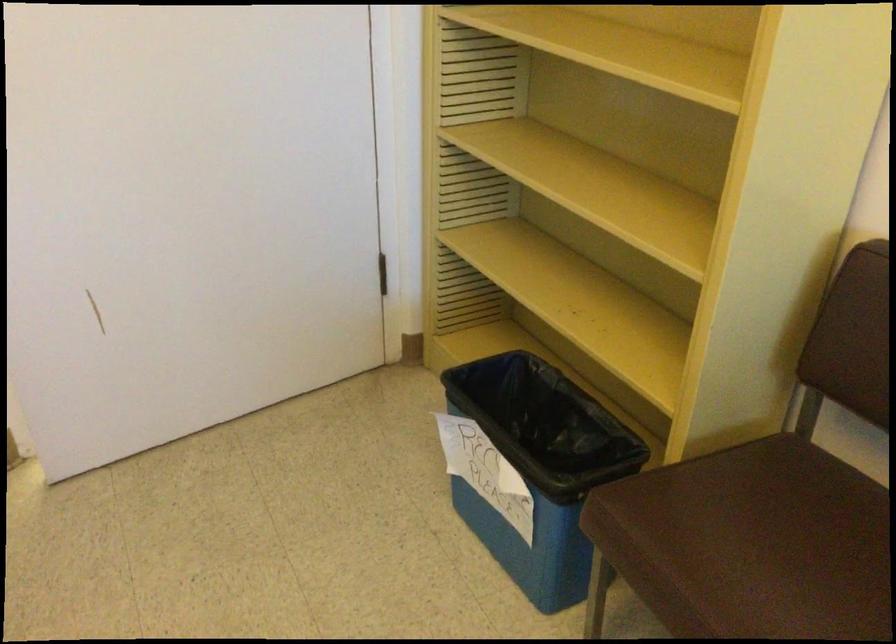
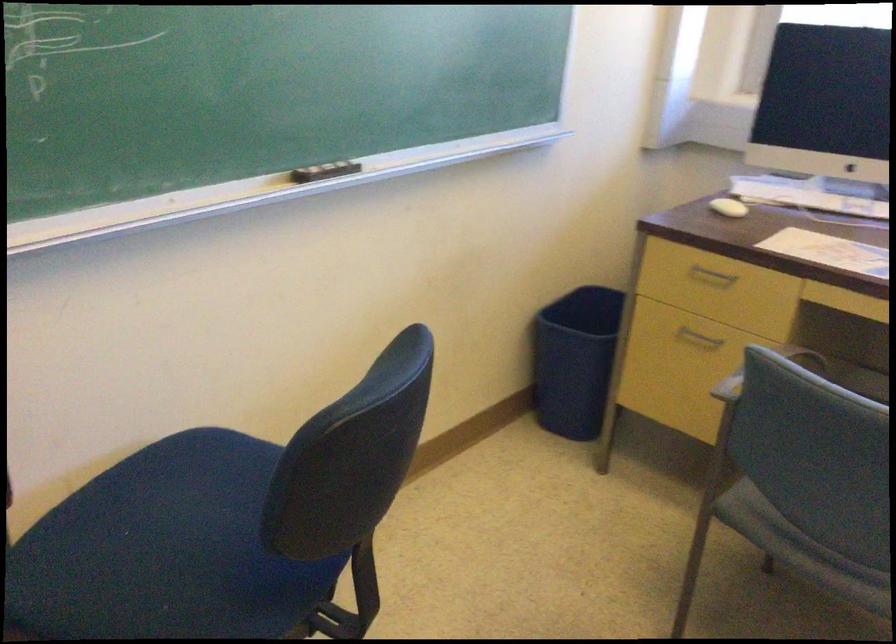
First-person continuous shooting, in which direction is the camera rotating?

The camera rotated toward right-down.